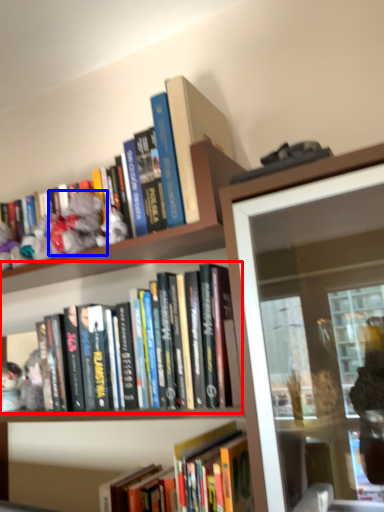
Question: Which point is further to the camera, book (highlighted by a red box) or toy (highlighted by a blue box)?

Choices:
 (A) book
 (B) toy

Answer: (B)